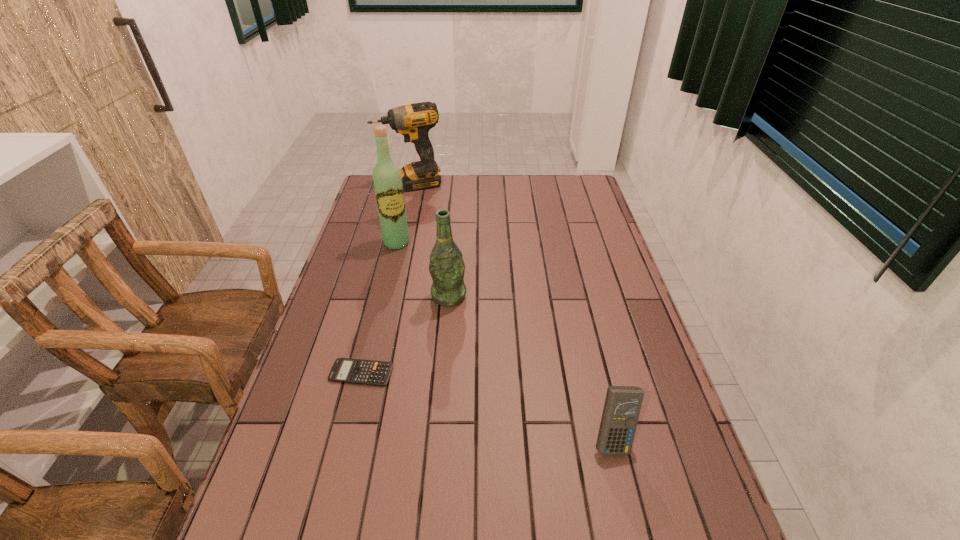
Locate an element on the screen. The height and width of the screenshot is (540, 960). object present at the far edge is located at coordinates (413, 121).

Identify the location of calculator located in the left edge section of the desktop. (346, 370).

Find the location of `wine bottle at the left edge`. wine bottle at the left edge is located at coordinates (387, 180).

Locate an element on the screen. This screenshot has width=960, height=540. drill that is positioned at the left edge is located at coordinates (413, 121).

I want to click on object present at the right edge, so click(622, 406).

The height and width of the screenshot is (540, 960). Identify the location of object located in the far left corner section of the desktop. (413, 121).

In the image, there is a desktop. At what (x,y) coordinates should I click in order to perform the action: click on vacant space at the far edge. Please return your answer as a coordinate pair (x, y). Image resolution: width=960 pixels, height=540 pixels. Looking at the image, I should click on (538, 193).

In the image, there is a desktop. Where is `vacant space at the near edge`? vacant space at the near edge is located at coordinates (574, 518).

Image resolution: width=960 pixels, height=540 pixels. I want to click on free point at the left edge, so click(368, 320).

Identify the location of vacant space at the right edge of the desktop. The image size is (960, 540). (615, 314).